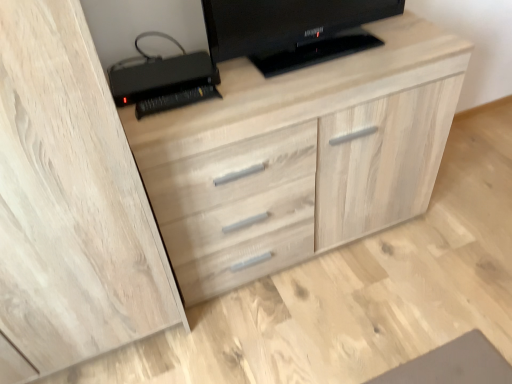
I want to click on free space in front of light wood dresser at center, so click(x=327, y=322).